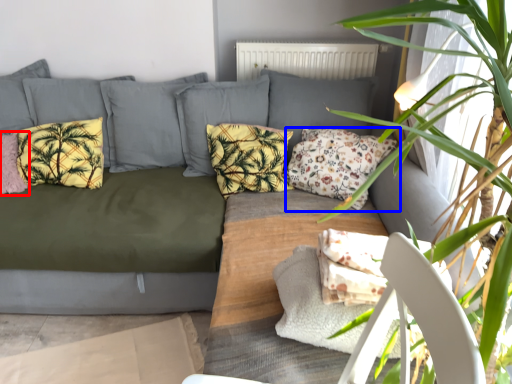
Question: Which point is closer to the camera, pillow (highlighted by a red box) or pillow (highlighted by a blue box)?

Choices:
 (A) pillow
 (B) pillow

Answer: (B)